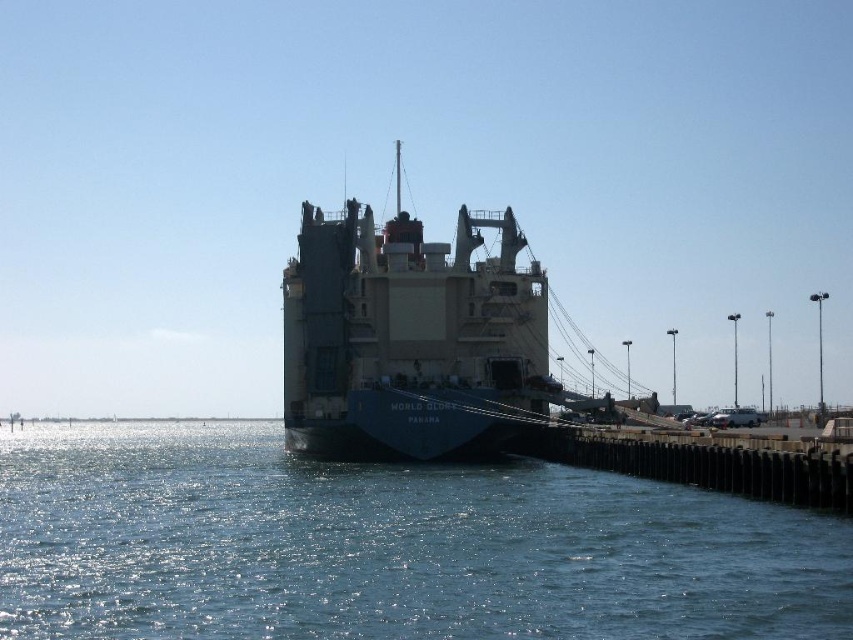
Question: Is blue water at lower left further to the viewer compared to green matte cargo ship at center?

Choices:
 (A) yes
 (B) no

Answer: (B)

Question: Can you confirm if blue water at lower left is thinner than green matte cargo ship at center?

Choices:
 (A) yes
 (B) no

Answer: (B)

Question: Does blue water at lower left have a greater width compared to green matte cargo ship at center?

Choices:
 (A) no
 (B) yes

Answer: (B)

Question: Which point is closer to the camera?

Choices:
 (A) (106, 611)
 (B) (537, 266)

Answer: (A)

Question: Which object is closer to the camera taking this photo?

Choices:
 (A) green matte cargo ship at center
 (B) blue water at lower left

Answer: (B)

Question: Among these points, which one is farthest from the camera?

Choices:
 (A) (393, 362)
 (B) (491, 513)

Answer: (A)